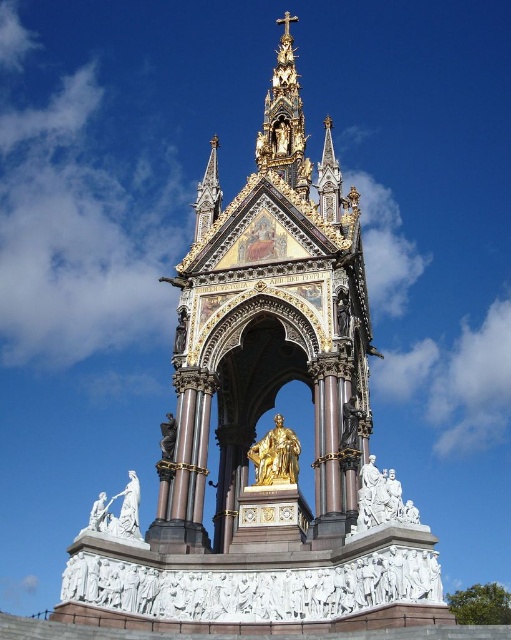
Question: Does white marble statue at lower left appear over bronze statue at center?

Choices:
 (A) no
 (B) yes

Answer: (A)

Question: In this image, where is white marble statues at lower right located relative to white marble statue at lower left?

Choices:
 (A) above
 (B) below

Answer: (A)

Question: Which point appears closest to the camera in this image?

Choices:
 (A) pyautogui.click(x=109, y=499)
 (B) pyautogui.click(x=277, y=449)
 (C) pyautogui.click(x=375, y=467)
 (D) pyautogui.click(x=164, y=460)

Answer: (C)

Question: Which of these objects is positioned farthest from the white marble statue at lower left?

Choices:
 (A) white marble statues at lower right
 (B) gold polished statue at center

Answer: (A)

Question: Which point is closer to the camera?

Choices:
 (A) (174, 445)
 (B) (281, 481)
 (C) (136, 515)

Answer: (C)

Question: From the image, what is the correct spatial relationship of gold polished statue at center in relation to bronze statue at center?

Choices:
 (A) left
 (B) right

Answer: (B)